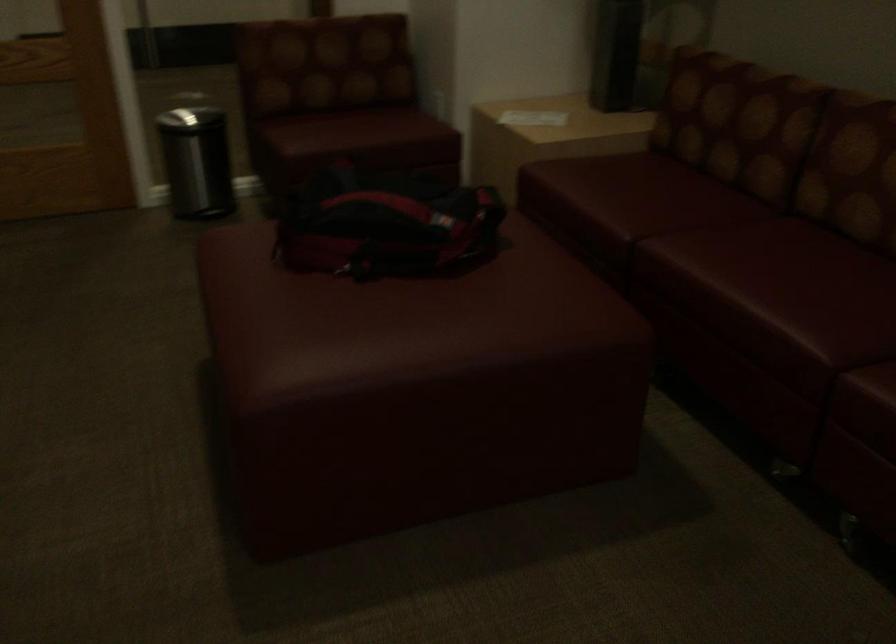
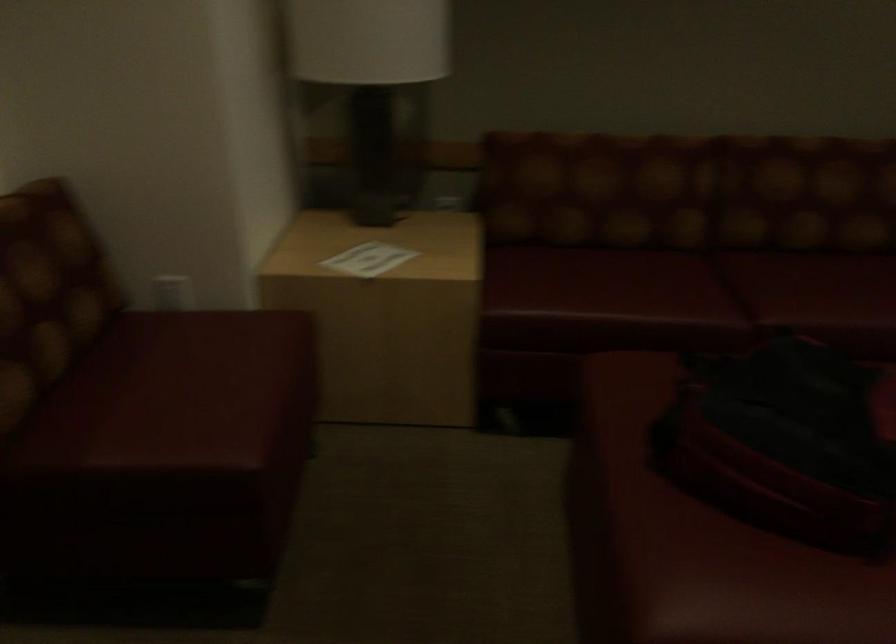
Locate, in the second image, the point that corresponds to point 675,213 in the first image.

(698, 286)